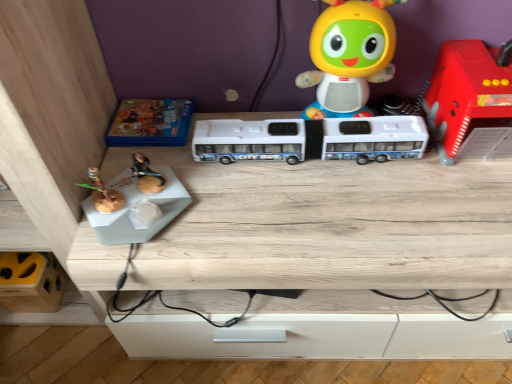
The height and width of the screenshot is (384, 512). In order to click on free space to the left of matte plastic toy at upper center, arranged as the 2th toy when viewed from the right in this screenshot , I will do [x=253, y=114].